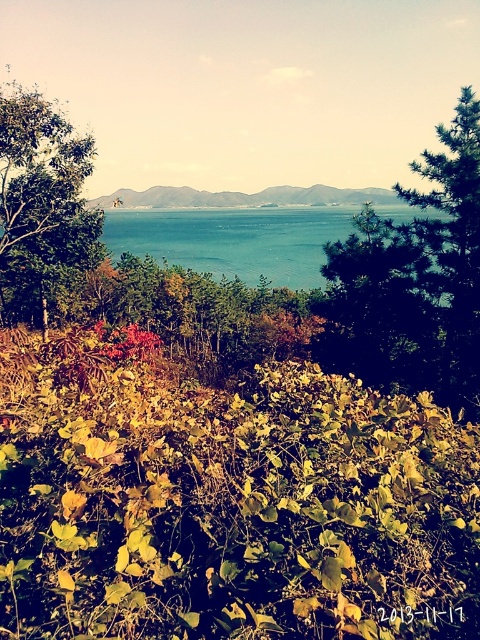
You are an artist planning to paint the landscape scene. You want to ensure that both the green textured tree at upper right and the green leafy tree at upper left are clearly visible. Given their sizes, which tree should you focus on detailing first to maintain balance in your painting?

The green textured tree at upper right occupies less space than the green leafy tree at upper left, so you should focus on detailing the smaller green textured tree at upper right first to ensure it stands out against the larger tree and maintains visual balance.

Based on the photo, you are standing at the point with coordinates point (x=23, y=186) and want to walk towards the point with coordinates point (x=192, y=205). According to the scene description, will you have to walk through any vegetation or water before reaching your destination?

Point (x=23, y=186) is in front of point (x=192, y=205), so you will have to walk through the dense growth of low lying vegetation with leaves in various shades of green, yellow, and hints of red before reaching your destination.

You are an artist planning to paint the landscape. You want to ensure the green textured tree at upper right and the green leafy tree at upper left are proportionally accurate. Which tree should you paint narrower in your artwork?

The green textured tree at upper right should be painted narrower because it has a lesser width compared to the green leafy tree at upper left.